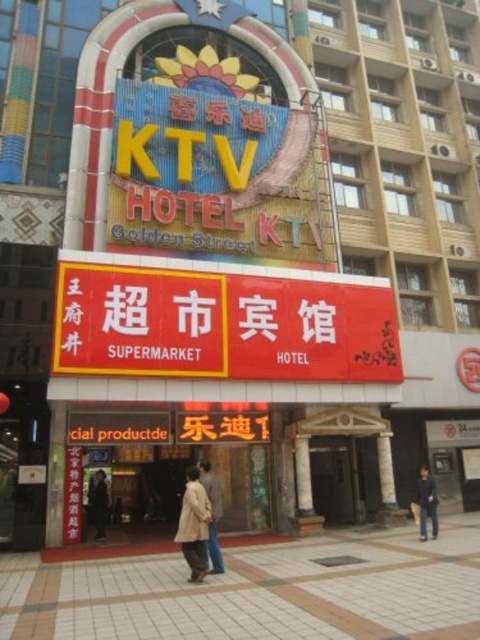
Question: Estimate the real-world distances between objects in this image. Which object is closer to the yellow matte signboard at center?

Choices:
 (A) light beige coat at lower center
 (B) dark blue jacket at lower right
 (C) light brown leather coat at center

Answer: (C)

Question: Which object is the farthest from the yellow matte signboard at center?

Choices:
 (A) dark blue jacket at lower right
 (B) light brown leather coat at center

Answer: (A)

Question: Is dark blue jacket at lower right smaller than light beige coat at lower center?

Choices:
 (A) yes
 (B) no

Answer: (B)

Question: Is light brown leather jacket at center closer to the viewer compared to light beige coat at lower center?

Choices:
 (A) yes
 (B) no

Answer: (A)

Question: Is yellow plastic ktv sign at upper center positioned before light brown leather jacket at center?

Choices:
 (A) no
 (B) yes

Answer: (A)

Question: Among these points, which one is farthest from the camera?

Choices:
 (A) (336, 316)
 (B) (420, 509)
 (C) (200, 561)

Answer: (A)